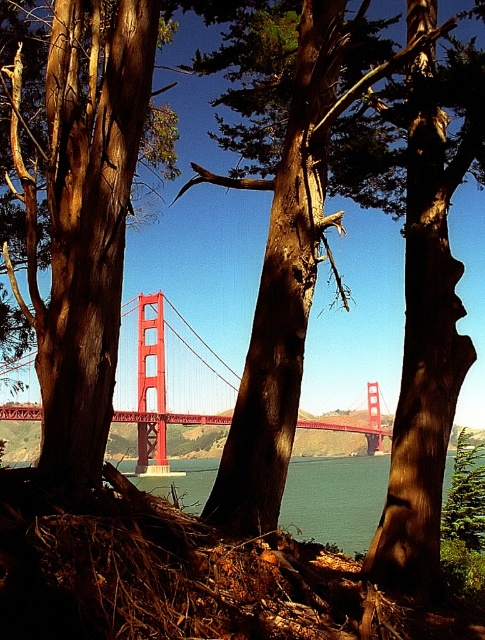
You are a photographer standing at the center of the Golden Gate Bridge scene. You notice a specific point marked at coordinates point (x=85, y=220). Based on the scene description, can you determine what object this point is located on?

The point (x=85, y=220) is located on the smooth brown tree trunk at center, as stated in the objects description.